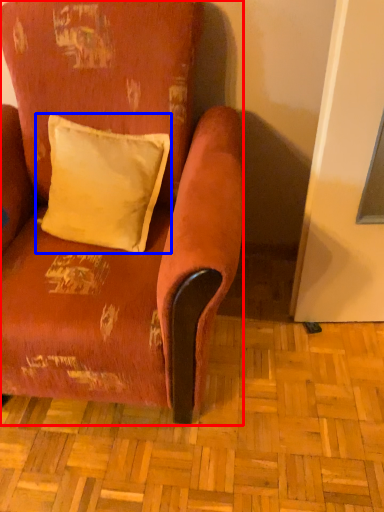
Question: Which object appears farthest to the camera in this image, chair (highlighted by a red box) or pillow (highlighted by a blue box)?

Choices:
 (A) chair
 (B) pillow

Answer: (B)